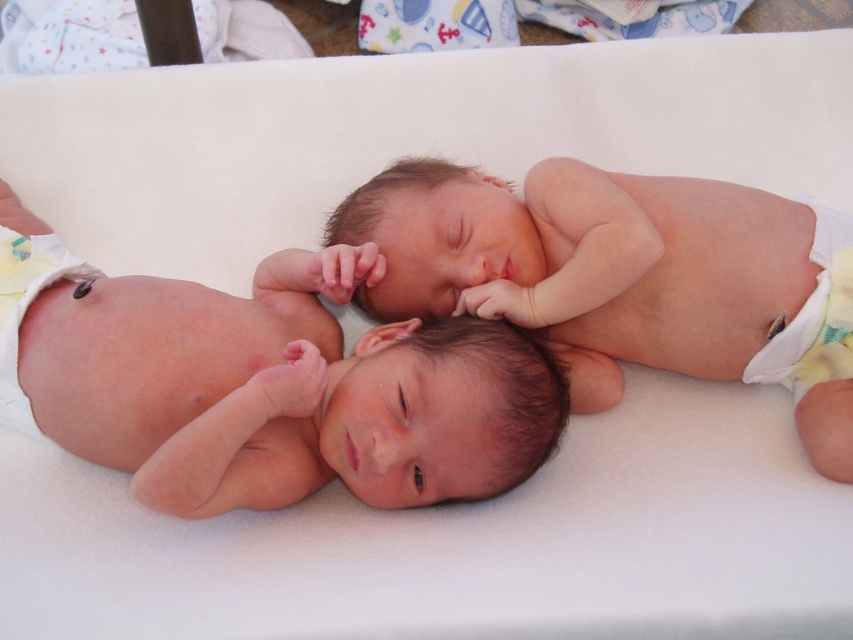
You are a nurse observing two newborn babies in the nursery. You notice the pink smooth skin at center and the smooth skin newborn at center. Which baby is closer to you?

The pink smooth skin at center is closer to you because it is in front of the smooth skin newborn at center.

You are a nurse checking the position of the two babies. You need to ensure that the white cloth diaper at left is not covering the pink smooth skin at center. Based on their current positions, is the diaper covering the skin?

The pink smooth skin at center is to the right of white cloth diaper at left, so the diaper is not covering the skin.